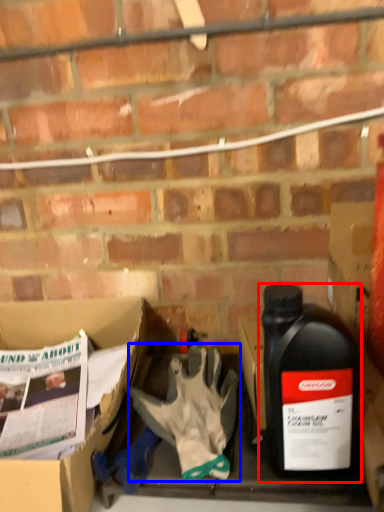
Question: Which object appears closest to the camera in this image, bottle (highlighted by a red box) or glove (highlighted by a blue box)?

Choices:
 (A) bottle
 (B) glove

Answer: (A)